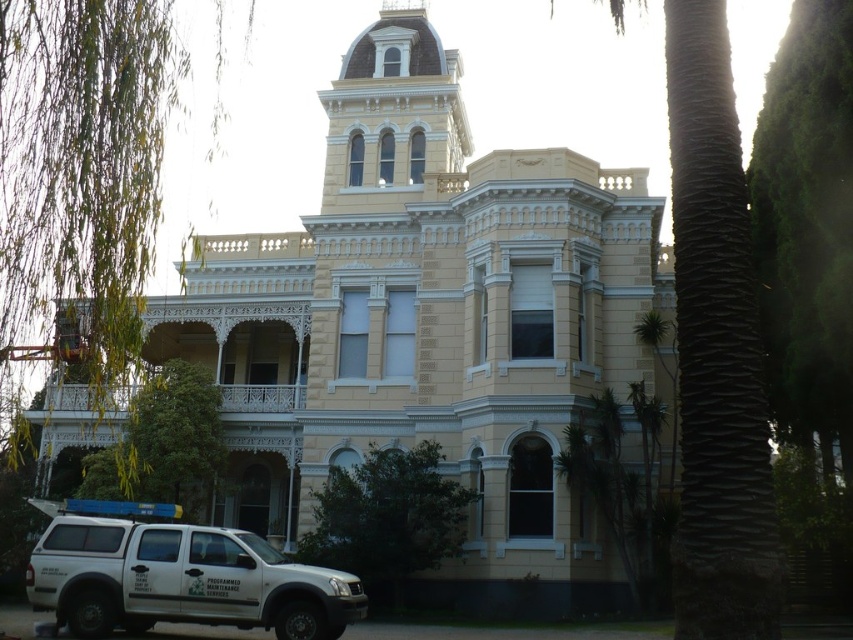
Question: Which point is farther to the camera?

Choices:
 (A) beige stone mansion at center
 (B) white matte suv at lower left

Answer: (A)

Question: Does beige stone mansion at center have a lesser width compared to white matte suv at lower left?

Choices:
 (A) no
 (B) yes

Answer: (A)

Question: Which point is farther from the camera taking this photo?

Choices:
 (A) (228, 262)
 (B) (90, 593)

Answer: (A)

Question: Can you confirm if beige stone mansion at center is positioned above white matte suv at lower left?

Choices:
 (A) yes
 (B) no

Answer: (A)

Question: Which object is farther from the camera taking this photo?

Choices:
 (A) white matte suv at lower left
 (B) beige stone mansion at center

Answer: (B)

Question: Does beige stone mansion at center appear on the left side of white matte suv at lower left?

Choices:
 (A) no
 (B) yes

Answer: (A)